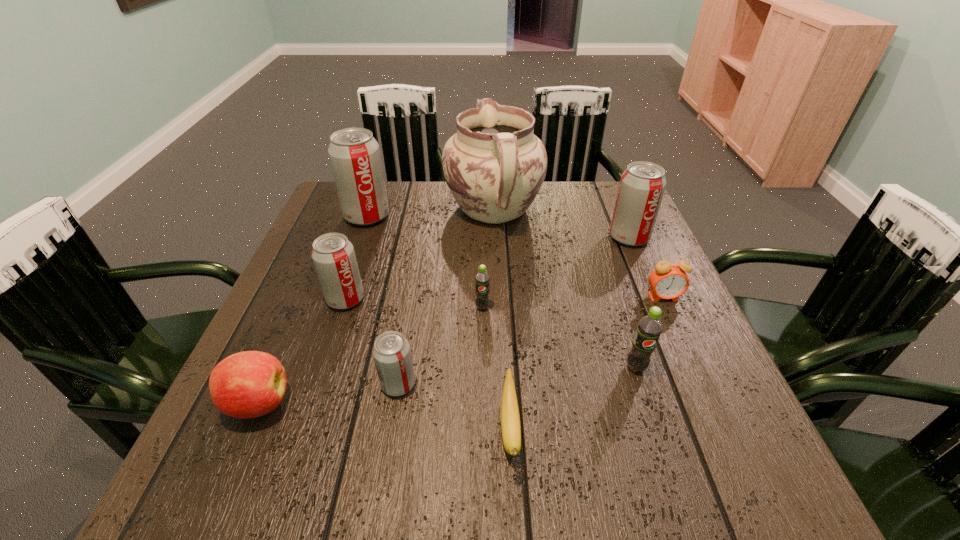
Locate which gray soda can is the fourth closest to the smaller green soda. Please provide its 2D coordinates. Your answer should be formatted as a tuple, i.e. [(x, y)], where the tuple contains the x and y coordinates of a point satisfying the conditions above.

[(354, 154)]